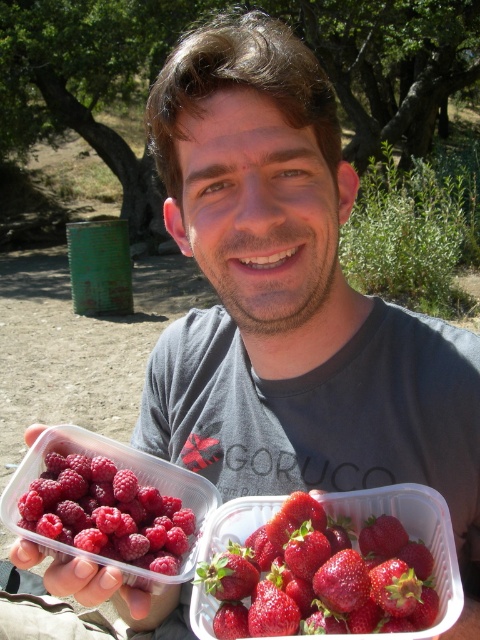
Is raspberry matte at left thinner than shiny red strawberries at center?

Indeed, raspberry matte at left has a lesser width compared to shiny red strawberries at center.

Is raspberry matte at left above shiny red strawberries at center?

Indeed, raspberry matte at left is positioned over shiny red strawberries at center.

Which is in front, point (79, 465) or point (240, 540)?

Positioned in front is point (240, 540).

Identify the location of raspberry matte at left. This screenshot has height=640, width=480. 107,513.